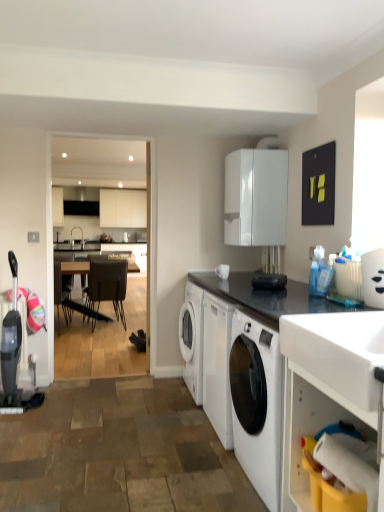
In order to face white glossy container at upper right, should I rotate leftwards or rightwards?

You should rotate right by 23.295 degrees.

The image size is (384, 512). Describe the element at coordinates (311, 333) in the screenshot. I see `white glossy countertop at lower right, the 2th countertop viewed from the top` at that location.

The width and height of the screenshot is (384, 512). What do you see at coordinates (265, 296) in the screenshot?
I see `black granite countertop at center, arranged as the 1th countertop when viewed from the top` at bounding box center [265, 296].

Describe the element at coordinates (107, 284) in the screenshot. I see `leather-like dark brown chair at center, which ranks as the 1th chair in front-to-back order` at that location.

Measure the distance between point (105, 259) and camera.

Point (105, 259) is 6.25 meters from camera.

Measure the distance between point (67, 279) and camera.

A distance of 6.40 meters exists between point (67, 279) and camera.

Find the location of `white glossy container at upper right`. white glossy container at upper right is located at coordinates (373, 278).

From a real-world perspective, who is located higher, dark brown leather chair at center, the first chair when ordered from left to right, or white glossy sink at upper right?

white glossy sink at upper right.

How many degrees apart are the facing directions of dark brown leather chair at center, the 1th chair in the back-to-front sequence, and white glossy sink at upper right?

The facing directions of dark brown leather chair at center, the 1th chair in the back-to-front sequence, and white glossy sink at upper right are 91.2 degrees apart.

Can you confirm if dark brown leather chair at center, the first chair when ordered from left to right, is shorter than white glossy sink at upper right?

No, dark brown leather chair at center, the first chair when ordered from left to right, is not shorter than white glossy sink at upper right.

From the image's perspective, is dark brown leather chair at center, the first chair when ordered from left to right, above white glossy sink at upper right?

No, from the image's perspective, dark brown leather chair at center, the first chair when ordered from left to right, is not on top of white glossy sink at upper right.

Measure the distance from leather-like dark brown chair at center, which appears as the 1th chair when viewed from the right, to black granite countertop at center, arranged as the 1th countertop when viewed from the top.

leather-like dark brown chair at center, which appears as the 1th chair when viewed from the right, is 3.15 meters from black granite countertop at center, arranged as the 1th countertop when viewed from the top.

Which object is closer to the camera, leather-like dark brown chair at center, which ranks as the 1th chair in front-to-back order, or black granite countertop at center, arranged as the 1th countertop when viewed from the top?

black granite countertop at center, arranged as the 1th countertop when viewed from the top, is closer to the camera.

From a real-world perspective, between leather-like dark brown chair at center, arranged as the second chair when viewed from the back, and black granite countertop at center, arranged as the 1th countertop when viewed from the top, who is vertically higher?

black granite countertop at center, arranged as the 1th countertop when viewed from the top, from a real-world perspective.

Is point (90, 307) positioned in front of point (287, 287)?

No, (90, 307) is further to viewer.

Based on the photo, is leather-like dark brown chair at center, which appears as the 1th chair when viewed from the right, in contact with white glossy cabinet at upper center?

No, leather-like dark brown chair at center, which appears as the 1th chair when viewed from the right, is not touching white glossy cabinet at upper center.

From a real-world perspective, is leather-like dark brown chair at center, the second chair in the left-to-right sequence, beneath white glossy cabinet at upper center?

Yes.

Based on the photo, is leather-like dark brown chair at center, arranged as the second chair when viewed from the back, oriented away from white glossy cabinet at upper center?

No, white glossy cabinet at upper center is not at the back of leather-like dark brown chair at center, arranged as the second chair when viewed from the back.

Is leather-like dark brown chair at center, which appears as the 1th chair when viewed from the right, to the right of white glossy cabinet at upper center from the viewer's perspective?

Incorrect, leather-like dark brown chair at center, which appears as the 1th chair when viewed from the right, is not on the right side of white glossy cabinet at upper center.

Based on their positions, is white glossy container at upper right located to the left or right of dark brown leather chair at center, the first chair when ordered from left to right?

white glossy container at upper right is to the right of dark brown leather chair at center, the first chair when ordered from left to right.

Is white glossy container at upper right not inside dark brown leather chair at center, placed as the 2th chair when sorted from front to back?

Yes, white glossy container at upper right is located beyond the bounds of dark brown leather chair at center, placed as the 2th chair when sorted from front to back.

Between white glossy container at upper right and dark brown leather chair at center, which is the 2th chair in right-to-left order, which one has smaller size?

white glossy container at upper right is smaller.

Is white glossy countertop at lower right, the 2th countertop viewed from the top, at the back of white glossy sink at upper right?

white glossy sink at upper right does not have its back to white glossy countertop at lower right, the 2th countertop viewed from the top.

Looking at their sizes, would you say white glossy sink at upper right is wider or thinner than white glossy countertop at lower right, the 2th countertop viewed from the top?

white glossy sink at upper right is thinner than white glossy countertop at lower right, the 2th countertop viewed from the top.

Are white glossy sink at upper right and white glossy countertop at lower right, the 1th countertop in the bottom-to-top sequence, beside each other?

white glossy sink at upper right and white glossy countertop at lower right, the 1th countertop in the bottom-to-top sequence, are clearly separated.

How different are the orientations of white glossy sink at upper right and white glossy countertop at lower right, the 1th countertop in the bottom-to-top sequence, in degrees?

1.16 degrees separate the facing orientations of white glossy sink at upper right and white glossy countertop at lower right, the 1th countertop in the bottom-to-top sequence.

Does point (277, 301) come farther from viewer compared to point (229, 184)?

No, it is in front of (229, 184).

From the image's perspective, which is above, black granite countertop at center, acting as the 2th countertop starting from the bottom, or white glossy cabinet at upper center?

white glossy cabinet at upper center appears higher in the image.

Locate an element on the screen. The width and height of the screenshot is (384, 512). cabinetry above the black granite countertop at center, acting as the 2th countertop starting from the bottom (from a real-world perspective) is located at coordinates (256, 197).

Considering the positions of objects black granite countertop at center, arranged as the 1th countertop when viewed from the top, and white glossy cabinet at upper center in the image provided, who is behind, black granite countertop at center, arranged as the 1th countertop when viewed from the top, or white glossy cabinet at upper center?

Positioned behind is white glossy cabinet at upper center.

Between black granite countertop at center, arranged as the 1th countertop when viewed from the top, and dark brown leather chair at center, the 1th chair in the back-to-front sequence, which one has smaller size?

black granite countertop at center, arranged as the 1th countertop when viewed from the top.

From a real-world perspective, is black granite countertop at center, arranged as the 1th countertop when viewed from the top, positioned above or below dark brown leather chair at center, the first chair when ordered from left to right?

black granite countertop at center, arranged as the 1th countertop when viewed from the top, is situated higher than dark brown leather chair at center, the first chair when ordered from left to right, in the real world.

Is dark brown leather chair at center, the first chair when ordered from left to right, at the back of black granite countertop at center, arranged as the 1th countertop when viewed from the top?

That's not correct — black granite countertop at center, arranged as the 1th countertop when viewed from the top, is not looking away from dark brown leather chair at center, the first chair when ordered from left to right.

Is black granite countertop at center, arranged as the 1th countertop when viewed from the top, inside the boundaries of dark brown leather chair at center, placed as the 2th chair when sorted from front to back, or outside?

The correct answer is: outside.

Locate an element on the screen. This screenshot has height=512, width=384. sink above the dark brown leather chair at center, the 1th chair in the back-to-front sequence (from a real-world perspective) is located at coordinates (338, 351).

Identify the location of the 1st chair counting from the left side of the black granite countertop at center, acting as the 2th countertop starting from the bottom. (107, 284).

Looking at the image, which one is located closer to white glossy cabinet at upper center, leather-like dark brown chair at center, the second chair in the left-to-right sequence, or white glossy container at upper right?

white glossy container at upper right lies closer to white glossy cabinet at upper center than the other object.

Based on their spatial positions, is white glossy cabinet at upper center or leather-like dark brown chair at center, which appears as the 1th chair when viewed from the right, closer to dark brown leather chair at center, the first chair when ordered from left to right?

Based on the image, leather-like dark brown chair at center, which appears as the 1th chair when viewed from the right, appears to be nearer to dark brown leather chair at center, the first chair when ordered from left to right.

Based on their spatial positions, is white glossy container at upper right or dark brown leather chair at center, the first chair when ordered from left to right, further from black granite countertop at center, acting as the 2th countertop starting from the bottom?

dark brown leather chair at center, the first chair when ordered from left to right, is positioned further to the anchor black granite countertop at center, acting as the 2th countertop starting from the bottom.

Based on their spatial positions, is dark brown leather chair at center, which is the 2th chair in right-to-left order, or white glossy sink at upper right closer to leather-like dark brown chair at center, the second chair in the left-to-right sequence?

The object closer to leather-like dark brown chair at center, the second chair in the left-to-right sequence, is dark brown leather chair at center, which is the 2th chair in right-to-left order.

In the scene shown: Considering their positions, is leather-like dark brown chair at center, the second chair in the left-to-right sequence, positioned further to black granite countertop at center, acting as the 2th countertop starting from the bottom, than white glossy countertop at lower right, the 1th countertop in the bottom-to-top sequence?

The object further to black granite countertop at center, acting as the 2th countertop starting from the bottom, is leather-like dark brown chair at center, the second chair in the left-to-right sequence.

From the image, which object appears to be farther from leather-like dark brown chair at center, the second chair in the left-to-right sequence, white glossy countertop at lower right, the 1th countertop in the bottom-to-top sequence, or white glossy cabinet at upper center?

white glossy countertop at lower right, the 1th countertop in the bottom-to-top sequence.

Considering their positions, is white glossy container at upper right positioned closer to white glossy cabinet at upper center than leather-like dark brown chair at center, arranged as the second chair when viewed from the back?

white glossy container at upper right.

Considering their positions, is white glossy sink at upper right positioned closer to dark brown leather chair at center, the first chair when ordered from left to right, than white glossy cabinet at upper center?

The object closer to dark brown leather chair at center, the first chair when ordered from left to right, is white glossy cabinet at upper center.

You are a GUI agent. You are given a task and a screenshot of the screen. Output one action in this format:
    pyautogui.click(x=<x>, y=<y>)
    Task: Click on the cabinetry between white glossy container at upper right and dark brown leather chair at center, placed as the 2th chair when sorted from front to back, from front to back
    
    Given the screenshot: What is the action you would take?
    pyautogui.click(x=256, y=197)

You are a GUI agent. You are given a task and a screenshot of the screen. Output one action in this format:
    pyautogui.click(x=<x>, y=<y>)
    Task: Click on the appliance positioned between black granite countertop at center, acting as the 2th countertop starting from the bottom, and dark brown leather chair at center, which is the 2th chair in right-to-left order, from near to far
    Image resolution: width=384 pixels, height=512 pixels.
    Given the screenshot: What is the action you would take?
    pyautogui.click(x=373, y=278)

Locate an element on the screen. The height and width of the screenshot is (512, 384). appliance between black granite countertop at center, arranged as the 1th countertop when viewed from the top, and leather-like dark brown chair at center, which appears as the 1th chair when viewed from the right, along the z-axis is located at coordinates (373, 278).

Identify the location of cabinetry between white glossy sink at upper right and leather-like dark brown chair at center, which appears as the 1th chair when viewed from the right, in the front-back direction. (256, 197).